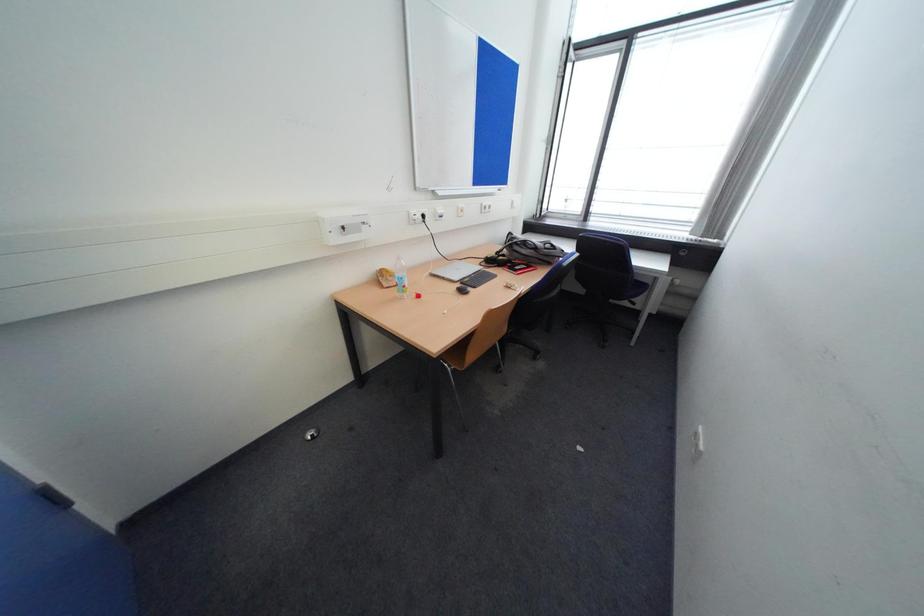
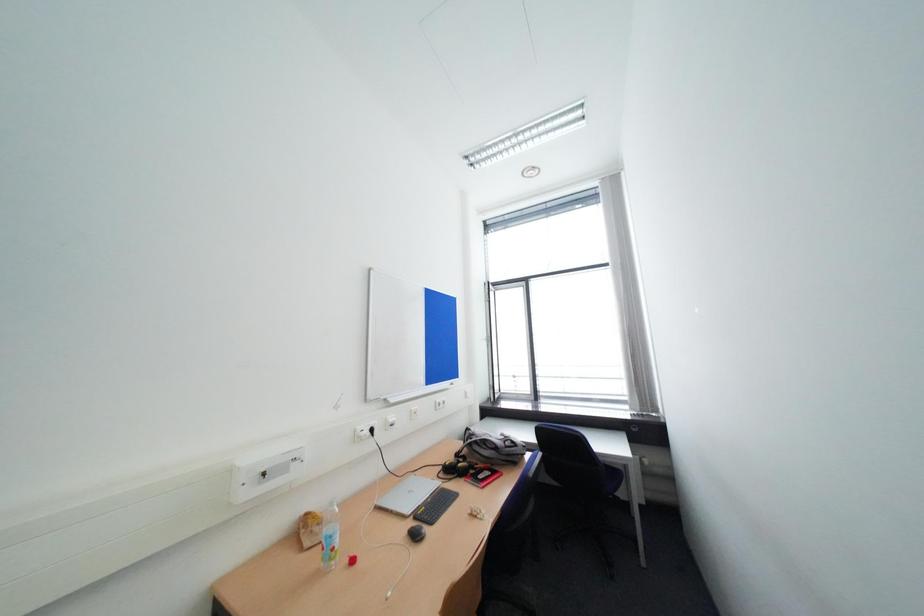
Question: The images are taken continuously from a first-person perspective. In which direction is your viewpoint rotating?

Choices:
 (A) Left
 (B) Right
 (C) Up
 (D) Down

Answer: (C)